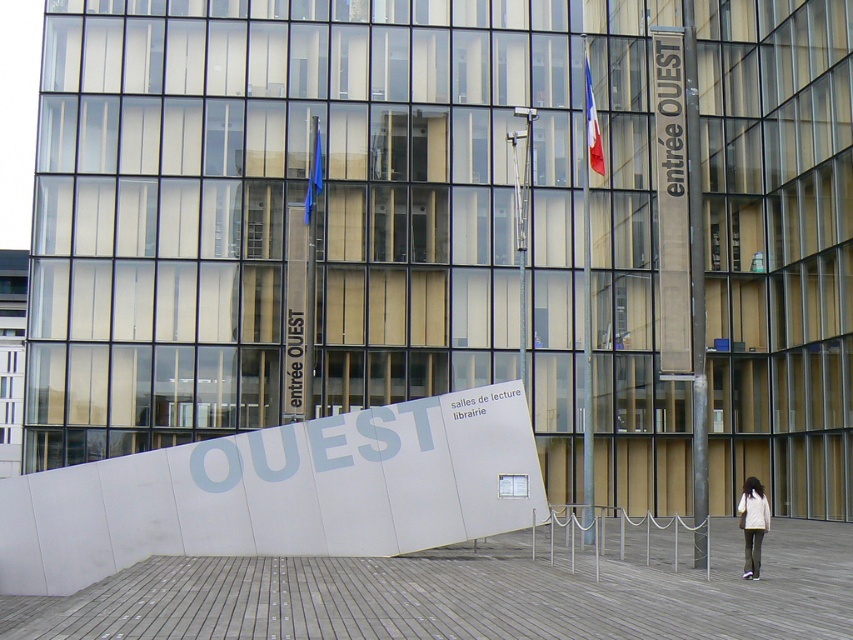
What is the position of the French flag at upper center relative to the blue fabric flag at center?

The French flag at upper center is positioned to the right of the blue fabric flag at center.